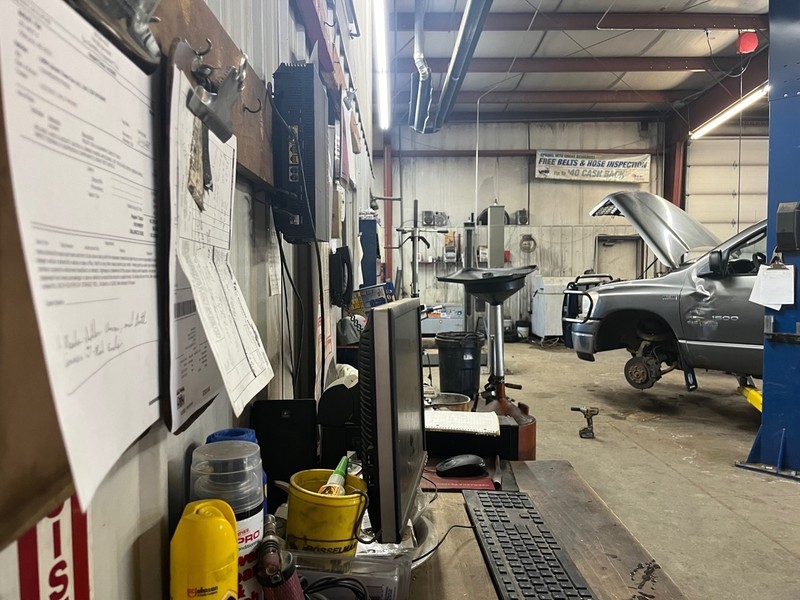
Image resolution: width=800 pixels, height=600 pixels. What are the coordinates of `monitor` in the screenshot? It's located at (398, 423).